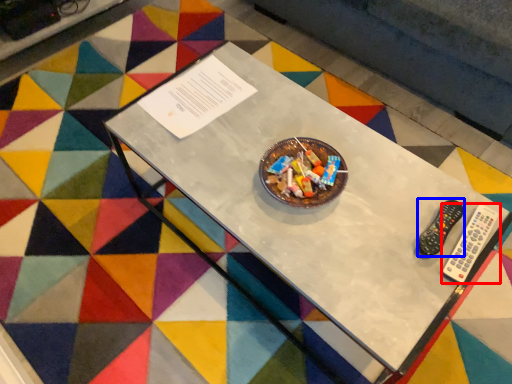
Question: Among these objects, which one is farthest to the camera, remote control (highlighted by a red box) or control (highlighted by a blue box)?

Choices:
 (A) remote control
 (B) control

Answer: (B)